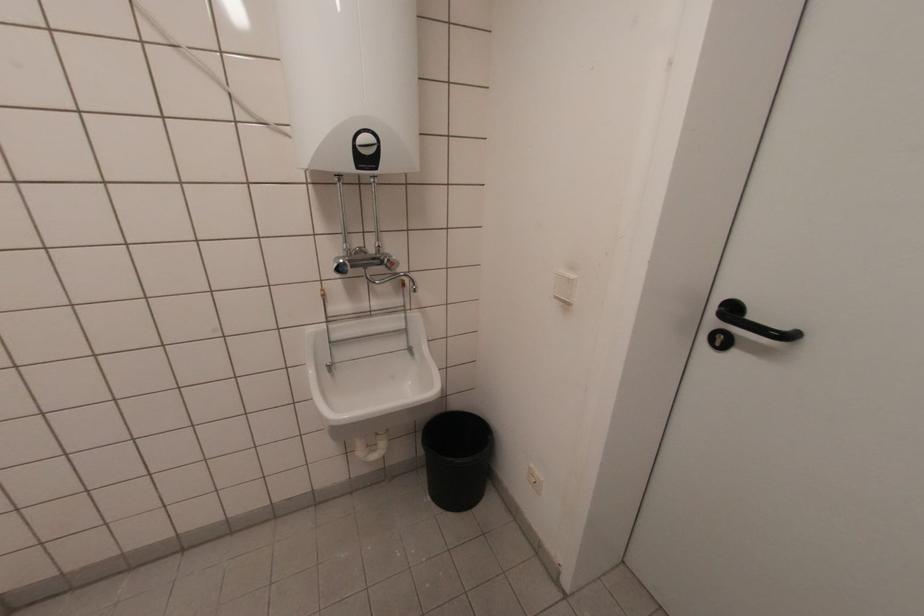
What do you see at coordinates (366, 142) in the screenshot? Image resolution: width=924 pixels, height=616 pixels. I see `the water heater dial` at bounding box center [366, 142].